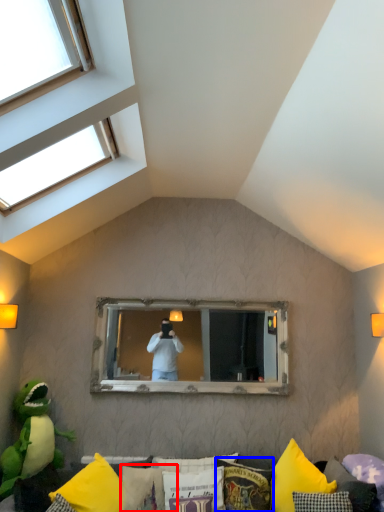
Question: Which object appears closest to the camera in this image, pillow (highlighted by a red box) or pillow (highlighted by a blue box)?

Choices:
 (A) pillow
 (B) pillow

Answer: (B)